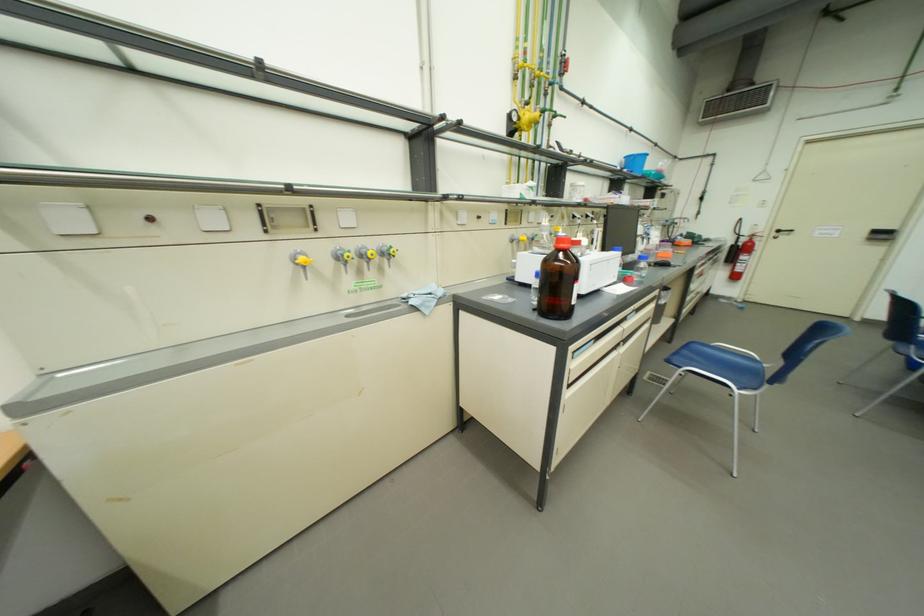
What do you see at coordinates (345, 256) in the screenshot? I see `the yellow valve handle` at bounding box center [345, 256].